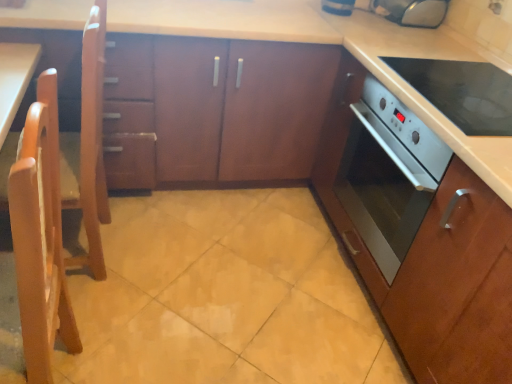
The width and height of the screenshot is (512, 384). What do you see at coordinates (84, 143) in the screenshot? I see `light wood chair at left, arranged as the second chair when viewed from the front` at bounding box center [84, 143].

I want to click on white glossy oven at right, so click(x=462, y=92).

At what (x,y) coordinates should I click in order to perform the action: click on blue glossy toaster at upper center, which is counted as the 1th appliance, starting from the left. Please return your answer as a coordinate pair (x, y). Image resolution: width=512 pixels, height=384 pixels. Looking at the image, I should click on (338, 7).

Find the location of a particular element. This screenshot has height=384, width=512. satin wood oven at center, acting as the first cabinetry starting from the right is located at coordinates (418, 233).

Describe the element at coordinates (418, 233) in the screenshot. I see `satin wood oven at center, acting as the first cabinetry starting from the right` at that location.

What do you see at coordinates (40, 236) in the screenshot? Image resolution: width=512 pixels, height=384 pixels. I see `light wood chair at left, the second chair viewed from the back` at bounding box center [40, 236].

Where is `light wood chair at left, arranged as the second chair when viewed from the front`? The image size is (512, 384). light wood chair at left, arranged as the second chair when viewed from the front is located at coordinates (84, 143).

Based on the photo, considering the relative positions of satin wood oven at center, acting as the first cabinetry starting from the right, and light wood chair at left, the 1th chair from the back, in the image provided, is satin wood oven at center, acting as the first cabinetry starting from the right, in front of light wood chair at left, the 1th chair from the back,?

Yes, satin wood oven at center, acting as the first cabinetry starting from the right, is closer to the camera.

Is satin wood oven at center, acting as the first cabinetry starting from the right, in contact with light wood chair at left, the 1th chair from the back?

No.

You are a GUI agent. You are given a task and a screenshot of the screen. Output one action in this format:
    pyautogui.click(x=<x>, y=<y>)
    Task: Click on the chair behind the satin wood oven at center, acting as the first cabinetry starting from the right
    
    Given the screenshot: What is the action you would take?
    pyautogui.click(x=84, y=143)

Is point (397, 22) in front of point (355, 119)?

No, it is not.

Between metallic silver toaster at upper right, which is the 2th appliance from left to right, and satin wood oven at center, acting as the first cabinetry starting from the right, which one appears on the left side from the viewer's perspective?

Result: satin wood oven at center, acting as the first cabinetry starting from the right, is more to the left.

Would you say metallic silver toaster at upper right, the first appliance in the right-to-left sequence, is outside satin wood oven at center, acting as the first cabinetry starting from the right?

metallic silver toaster at upper right, the first appliance in the right-to-left sequence, lies outside satin wood oven at center, acting as the first cabinetry starting from the right,'s area.

Who is bigger, metallic silver toaster at upper right, which is the 2th appliance from left to right, or satin wood oven at center, acting as the first cabinetry starting from the right?

satin wood oven at center, acting as the first cabinetry starting from the right, is bigger.

Is light wood chair at left, the 1th chair when ordered from front to back, placed right next to metallic silver toaster at upper right, the first appliance in the right-to-left sequence?

No, light wood chair at left, the 1th chair when ordered from front to back, is not with metallic silver toaster at upper right, the first appliance in the right-to-left sequence.

Is light wood chair at left, the second chair viewed from the back, aimed at metallic silver toaster at upper right, which is the 2th appliance from left to right?

No, light wood chair at left, the second chair viewed from the back, is not facing towards metallic silver toaster at upper right, which is the 2th appliance from left to right.

From the picture: Is light wood chair at left, the 1th chair when ordered from front to back, taller or shorter than metallic silver toaster at upper right, which is the 2th appliance from left to right?

Considering their sizes, light wood chair at left, the 1th chair when ordered from front to back, has more height than metallic silver toaster at upper right, which is the 2th appliance from left to right.

From a real-world perspective, does light wood chair at left, the second chair viewed from the back, sit lower than metallic silver toaster at upper right, which is the 2th appliance from left to right?

Indeed, from a real-world perspective, light wood chair at left, the second chair viewed from the back, is positioned beneath metallic silver toaster at upper right, which is the 2th appliance from left to right.

From the image's perspective, is white glossy oven at right located above or below light wood chair at left, the 1th chair when ordered from front to back?

Clearly, from the image's perspective, white glossy oven at right is above light wood chair at left, the 1th chair when ordered from front to back.

In the scene shown: Considering the sizes of white glossy oven at right and light wood chair at left, the 1th chair when ordered from front to back, in the image, is white glossy oven at right wider or thinner than light wood chair at left, the 1th chair when ordered from front to back,?

Clearly, white glossy oven at right has more width compared to light wood chair at left, the 1th chair when ordered from front to back.

Does white glossy oven at right have a smaller size compared to light wood chair at left, the second chair viewed from the back?

Yes.

Could you tell me if white glossy oven at right is facing light wood chair at left, the 1th chair when ordered from front to back?

No.

Which is closer, (441, 303) or (33, 120)?

Point (441, 303).

Find the location of a particular element. The height and width of the screenshot is (384, 512). chair that is the 1st one when counting leftward from the satin wood oven at center, marked as the second cabinetry in a left-to-right arrangement is located at coordinates (40, 236).

Does satin wood oven at center, acting as the first cabinetry starting from the right, contain light wood chair at left, the second chair viewed from the back?

No, light wood chair at left, the second chair viewed from the back, is not a part of satin wood oven at center, acting as the first cabinetry starting from the right.

From the image's perspective, is satin wood oven at center, marked as the second cabinetry in a left-to-right arrangement, beneath light wood chair at left, the 1th chair when ordered from front to back?

Actually, satin wood oven at center, marked as the second cabinetry in a left-to-right arrangement, appears above light wood chair at left, the 1th chair when ordered from front to back, in the image.

In the scene shown: Can you confirm if satin wood oven at center, acting as the first cabinetry starting from the right, is smaller than blue glossy toaster at upper center, marked as the second appliance in a right-to-left arrangement?

No.

Is satin wood oven at center, acting as the first cabinetry starting from the right, oriented away from blue glossy toaster at upper center, which is counted as the 1th appliance, starting from the left?

No, satin wood oven at center, acting as the first cabinetry starting from the right, is not facing away from blue glossy toaster at upper center, which is counted as the 1th appliance, starting from the left.

From a real-world perspective, is satin wood oven at center, acting as the first cabinetry starting from the right, physically above blue glossy toaster at upper center, which is counted as the 1th appliance, starting from the left?

Incorrect, from a real-world perspective, satin wood oven at center, acting as the first cabinetry starting from the right, is lower than blue glossy toaster at upper center, which is counted as the 1th appliance, starting from the left.

Is satin wood oven at center, acting as the first cabinetry starting from the right, outside of blue glossy toaster at upper center, marked as the second appliance in a right-to-left arrangement?

Absolutely, satin wood oven at center, acting as the first cabinetry starting from the right, is external to blue glossy toaster at upper center, marked as the second appliance in a right-to-left arrangement.

Is point (338, 6) closer or farther from the camera than point (77, 335)?

Point (338, 6) is farther from the camera than point (77, 335).

Is light wood chair at left, the 1th chair when ordered from front to back, at the back of blue glossy toaster at upper center, marked as the second appliance in a right-to-left arrangement?

No, blue glossy toaster at upper center, marked as the second appliance in a right-to-left arrangement, is not facing the opposite direction of light wood chair at left, the 1th chair when ordered from front to back.

How distant is blue glossy toaster at upper center, which is counted as the 1th appliance, starting from the left, from light wood chair at left, the second chair viewed from the back?

5.05 feet.

This screenshot has width=512, height=384. Find the location of `chair that is the 2nd object located in front of the blue glossy toaster at upper center, which is counted as the 1th appliance, starting from the left`. chair that is the 2nd object located in front of the blue glossy toaster at upper center, which is counted as the 1th appliance, starting from the left is located at coordinates (40, 236).

Identify the location of cabinetry located in front of the light wood chair at left, arranged as the second chair when viewed from the front. (418, 233).

Find the location of `the 2nd appliance above the satin wood oven at center, acting as the first cabinetry starting from the right (from a real-world perspective)`. the 2nd appliance above the satin wood oven at center, acting as the first cabinetry starting from the right (from a real-world perspective) is located at coordinates (414, 11).

Looking at the image, which one is located further to yellow matte tile at center, light wood chair at left, arranged as the second chair when viewed from the front, or metallic silver toaster at upper right, the first appliance in the right-to-left sequence?

metallic silver toaster at upper right, the first appliance in the right-to-left sequence, is further to yellow matte tile at center.

When comparing their distances from white glossy oven at right, does blue glossy toaster at upper center, which is counted as the 1th appliance, starting from the left, or wooden cabinet at center, acting as the 2th cabinetry starting from the right, seem further?

Based on the image, wooden cabinet at center, acting as the 2th cabinetry starting from the right, appears to be further to white glossy oven at right.

Based on their spatial positions, is blue glossy toaster at upper center, which is counted as the 1th appliance, starting from the left, or light wood chair at left, arranged as the second chair when viewed from the front, closer to yellow matte tile at center?

Among the two, light wood chair at left, arranged as the second chair when viewed from the front, is located nearer to yellow matte tile at center.

In the scene shown: Estimate the real-world distances between objects in this image. Which object is closer to metallic silver toaster at upper right, the first appliance in the right-to-left sequence, blue glossy toaster at upper center, which is counted as the 1th appliance, starting from the left, or light wood chair at left, the second chair viewed from the back?

blue glossy toaster at upper center, which is counted as the 1th appliance, starting from the left, lies closer to metallic silver toaster at upper right, the first appliance in the right-to-left sequence, than the other object.

Consider the image. Estimate the real-world distances between objects in this image. Which object is further from light wood chair at left, the 1th chair when ordered from front to back, metallic silver toaster at upper right, the first appliance in the right-to-left sequence, or blue glossy toaster at upper center, which is counted as the 1th appliance, starting from the left?

metallic silver toaster at upper right, the first appliance in the right-to-left sequence, lies further to light wood chair at left, the 1th chair when ordered from front to back, than the other object.

Looking at the image, which one is located closer to light wood chair at left, the 1th chair from the back, light wood chair at left, the 1th chair when ordered from front to back, or yellow matte tile at center?

light wood chair at left, the 1th chair when ordered from front to back, lies closer to light wood chair at left, the 1th chair from the back, than the other object.

When comparing their distances from blue glossy toaster at upper center, which is counted as the 1th appliance, starting from the left, does white glossy oven at right or yellow matte tile at center seem further?

Based on the image, yellow matte tile at center appears to be further to blue glossy toaster at upper center, which is counted as the 1th appliance, starting from the left.

When comparing their distances from blue glossy toaster at upper center, which is counted as the 1th appliance, starting from the left, does metallic silver toaster at upper right, the first appliance in the right-to-left sequence, or white glossy oven at right seem further?

white glossy oven at right.

Where is `kitchen appliance located between light wood chair at left, the 1th chair when ordered from front to back, and blue glossy toaster at upper center, marked as the second appliance in a right-to-left arrangement, in the depth direction`? The image size is (512, 384). kitchen appliance located between light wood chair at left, the 1th chair when ordered from front to back, and blue glossy toaster at upper center, marked as the second appliance in a right-to-left arrangement, in the depth direction is located at coordinates (462, 92).

Identify the location of kitchen appliance between blue glossy toaster at upper center, which is counted as the 1th appliance, starting from the left, and yellow matte tile at center in the up-down direction. (462, 92).

The image size is (512, 384). I want to click on appliance located between white glossy oven at right and blue glossy toaster at upper center, marked as the second appliance in a right-to-left arrangement, in the depth direction, so click(414, 11).

Locate an element on the screen. The height and width of the screenshot is (384, 512). appliance located between light wood chair at left, the 1th chair when ordered from front to back, and blue glossy toaster at upper center, marked as the second appliance in a right-to-left arrangement, in the depth direction is located at coordinates (414, 11).